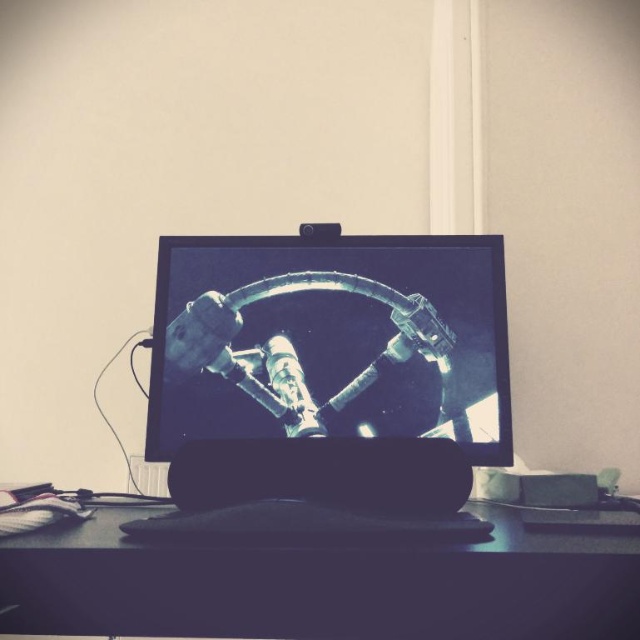
You are sitting at the desk and want to reach both the matte black monitor at center and the black matte computer desk at center. Which object will you touch first if you extend your hand forward?

You will touch the matte black monitor at center first because it is closer to you than the black matte computer desk at center.

Consider the image. Based on the scene described, which object is taller between the matte black monitor at center and the black matte computer desk at center?

The matte black monitor at center is taller than the black matte computer desk at center according to the description.

You are standing 1.5 meters away from the camera. You want to pick up the matte black monitor at center. Can you reach it without moving closer?

The matte black monitor at center is 1.15 meters from the camera. Since you are 1.5 meters away from the camera, you are farther than the monitor, so you cannot reach it without moving closer.